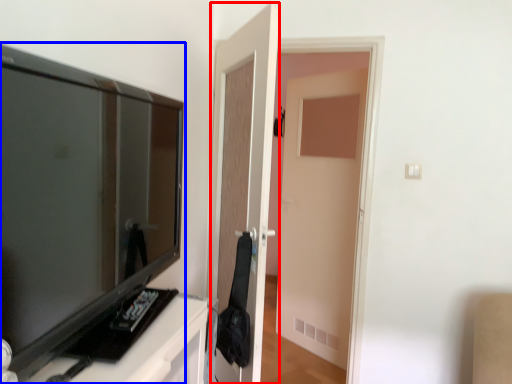
Question: Which of the following is the farthest to the observer, door (highlighted by a red box) or television (highlighted by a blue box)?

Choices:
 (A) door
 (B) television

Answer: (A)